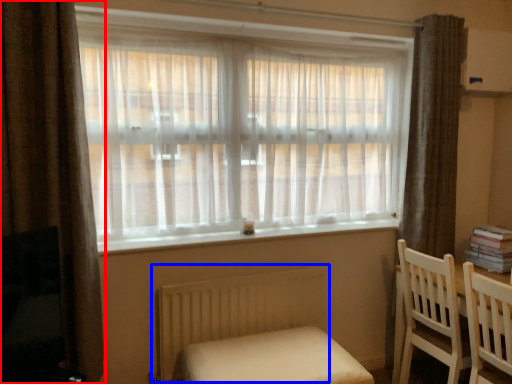
Question: Which of the following is the closest to the observer, curtain (highlighted by a red box) or radiator (highlighted by a blue box)?

Choices:
 (A) curtain
 (B) radiator

Answer: (A)